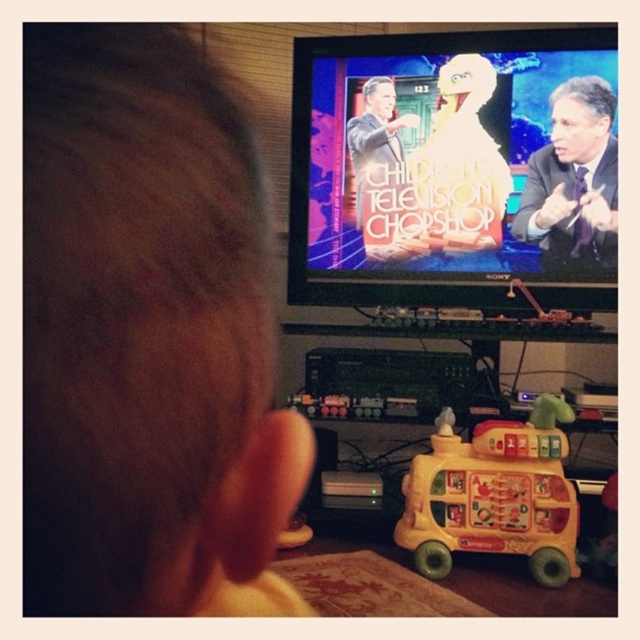
You are a photographer trying to capture a closeup of the brown matte hair at upper left and the yellow plastic bus at lower center. Which object should you zoom in on first to ensure both are in focus?

The brown matte hair at upper left is not as tall as the yellow plastic bus at lower center, so you should zoom in on the yellow plastic bus at lower center first to ensure both are in focus.

You are a toy collector who wants to place a new yellow plastic bus at lower center near the brown matte hair at upper left in the image. The minimum distance required between the bus and other objects is 4 feet. Can you safely place the bus there?

The brown matte hair at upper left is 4.43 feet away from yellow plastic bus at lower center. Since 4.43 feet is greater than the minimum required distance of 4 feet, you can safely place the bus there.

You are a photographer trying to capture the child watching TV. The child has brown matte hair at upper left and there is a yellow plastic bus at lower center in the frame. Which object should you focus on to ensure the child is in focus?

The brown matte hair at upper left is in front of the yellow plastic bus at lower center. To ensure the child is in focus, you should focus on the brown matte hair at upper left since it is closer to the camera and part of the child.